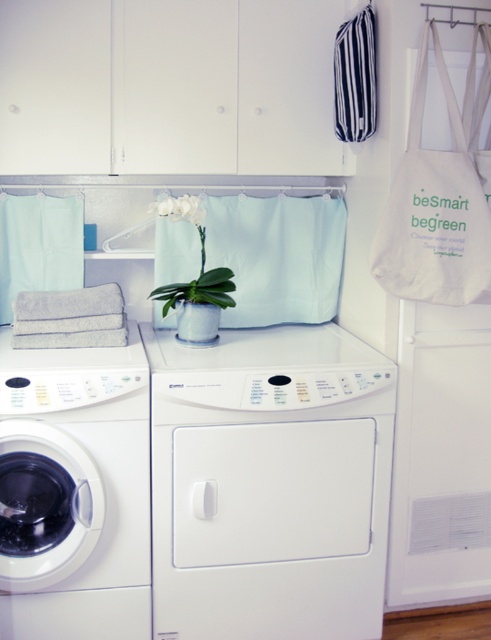
You are organizing laundry in the laundry room and see the mint fabric laundry at upper center and the striped fabric laundry bag at upper right. Which one is positioned lower in the image?

The mint fabric laundry at upper center is located below the striped fabric laundry bag at upper right, so it is positioned lower in the image.

You are trying to decide which laundry item to place first into the washing machine on the left. Based on their sizes, which one should you put in first, the mint fabric laundry at upper center or the striped fabric laundry bag at upper right?

The mint fabric laundry at upper center is wider than the striped fabric laundry bag at upper right, so you should put the mint fabric laundry at upper center in first to ensure it fits properly.